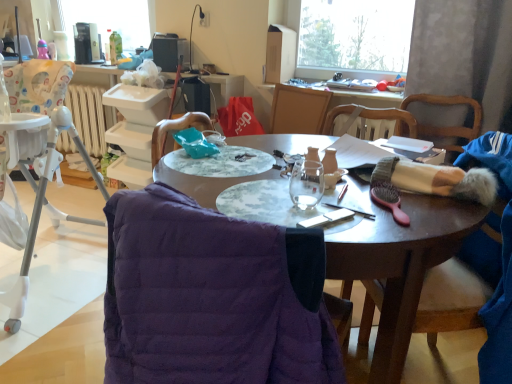
At what (x,y) coordinates should I click in order to perform the action: click on empty space that is ontop of matte purple jacket at lower left (from a real-world perspective). Please return your answer as a coordinate pair (x, y). The height and width of the screenshot is (384, 512). Looking at the image, I should click on (305, 178).